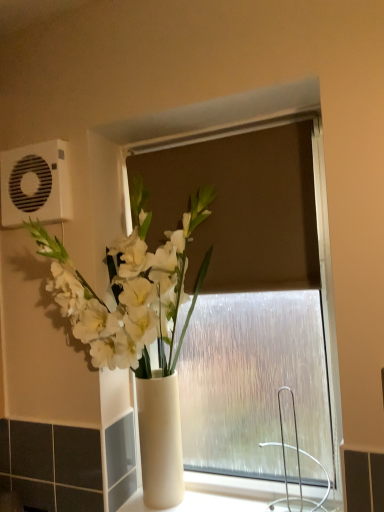
Question: From the image's perspective, relative to white plastic air conditioning unit at upper left, is white glossy vase at center above or below?

Choices:
 (A) below
 (B) above

Answer: (A)

Question: In the image, is white glossy vase at center positioned in front of or behind white plastic air conditioning unit at upper left?

Choices:
 (A) front
 (B) behind

Answer: (A)

Question: Do you think white glossy vase at center is within white plastic air conditioning unit at upper left, or outside of it?

Choices:
 (A) inside
 (B) outside

Answer: (B)

Question: Is white plastic air conditioning unit at upper left inside or outside of white glossy vase at center?

Choices:
 (A) inside
 (B) outside

Answer: (B)

Question: Considering the positions of point (49, 202) and point (122, 286), is point (49, 202) closer or farther from the camera than point (122, 286)?

Choices:
 (A) closer
 (B) farther

Answer: (B)

Question: Is white plastic air conditioning unit at upper left wider or thinner than white glossy vase at center?

Choices:
 (A) thin
 (B) wide

Answer: (A)

Question: Considering their positions, is white plastic air conditioning unit at upper left located in front of or behind white glossy vase at center?

Choices:
 (A) behind
 (B) front

Answer: (A)